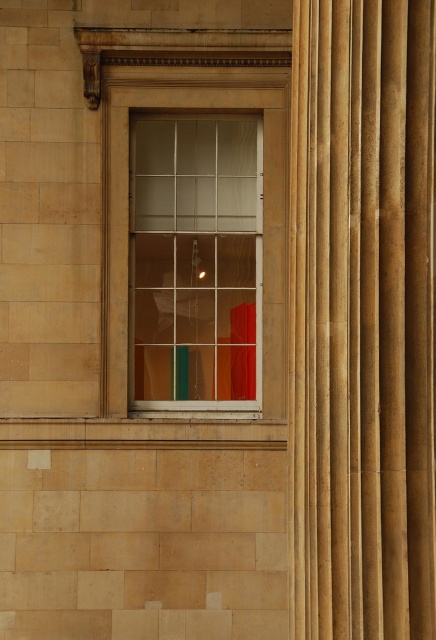
Question: Considering the relative positions of matte fabric curtain at center and clear glass window at center in the image provided, where is matte fabric curtain at center located with respect to clear glass window at center?

Choices:
 (A) right
 (B) left

Answer: (A)

Question: Which of the following is the closest to the observer?

Choices:
 (A) (146, 122)
 (B) (314, 134)

Answer: (B)

Question: Can you confirm if matte fabric curtain at center is smaller than clear glass window at center?

Choices:
 (A) no
 (B) yes

Answer: (B)

Question: Is matte fabric curtain at center smaller than clear glass window at center?

Choices:
 (A) yes
 (B) no

Answer: (A)